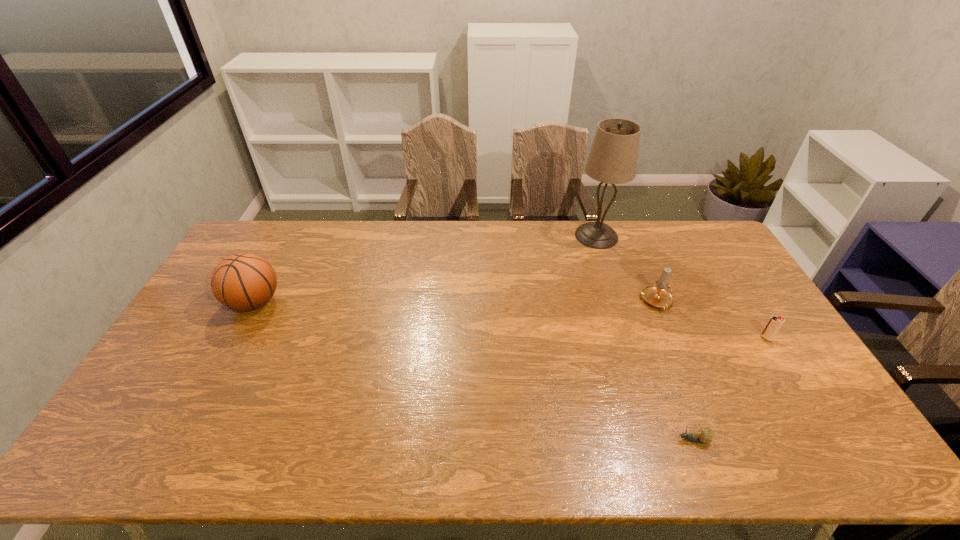
Locate an element on the screen. This screenshot has height=540, width=960. free point located on the right of the leftmost object is located at coordinates (307, 302).

Find the location of `vacant space situated on the front of the third tallest object`. vacant space situated on the front of the third tallest object is located at coordinates (669, 329).

At what (x,y) coordinates should I click in order to perform the action: click on free location located on the back of the second shortest object. Please return your answer as a coordinate pair (x, y). This screenshot has height=540, width=960. Looking at the image, I should click on (736, 290).

Image resolution: width=960 pixels, height=540 pixels. I want to click on free space located 0.240m on the front-facing side of the nearest object, so click(577, 440).

This screenshot has height=540, width=960. Find the location of `vacant space positioned 0.390m on the front-facing side of the nearest object`. vacant space positioned 0.390m on the front-facing side of the nearest object is located at coordinates (516, 440).

Identify the location of vacant space located 0.100m on the front-facing side of the nearest object. (635, 440).

Where is `object at the far edge`? The height and width of the screenshot is (540, 960). object at the far edge is located at coordinates [613, 156].

Where is `object that is at the near edge`? object that is at the near edge is located at coordinates (705, 435).

Find the location of a particular element. The image size is (960, 540). object located at the left edge is located at coordinates (243, 282).

Identify the location of object situated at the right edge. (774, 324).